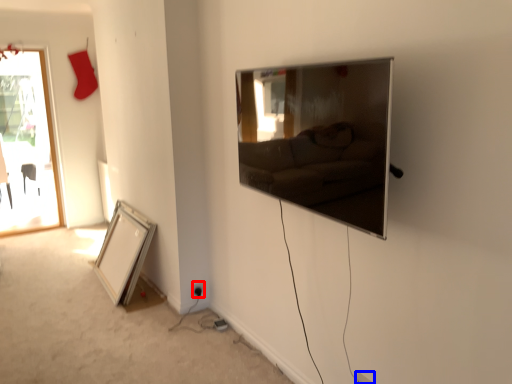
Question: Which object is closer to the camera taking this photo, electric outlet (highlighted by a red box) or electric outlet (highlighted by a blue box)?

Choices:
 (A) electric outlet
 (B) electric outlet

Answer: (B)